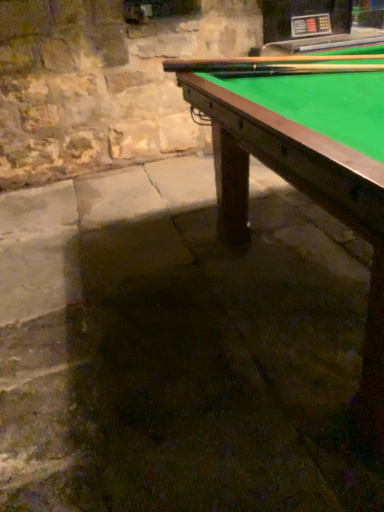
Describe the element at coordinates (306, 195) in the screenshot. I see `green felt billiard table at upper right` at that location.

Image resolution: width=384 pixels, height=512 pixels. In order to click on green felt billiard table at upper right in this screenshot , I will do `click(306, 195)`.

Considering the positions of objects green felt billiard table at upper right and smooth wood cue at upper right, the 2th cue in the top-to-bottom sequence, in the image provided, who is in front, green felt billiard table at upper right or smooth wood cue at upper right, the 2th cue in the top-to-bottom sequence,?

green felt billiard table at upper right is in front.

From the image's perspective, between green felt billiard table at upper right and smooth wood cue at upper right, which is the first cue from bottom to top, who is located below?

From the image's view, green felt billiard table at upper right is below.

Is green felt billiard table at upper right inside or outside of smooth wood cue at upper right, the 2th cue in the top-to-bottom sequence?

green felt billiard table at upper right is located beyond the bounds of smooth wood cue at upper right, the 2th cue in the top-to-bottom sequence.

Is green felt billiard table at upper right positioned far away from smooth wood cue at upper right, the 2th cue in the top-to-bottom sequence?

That's not correct — green felt billiard table at upper right is a little close to smooth wood cue at upper right, the 2th cue in the top-to-bottom sequence.

Can wooden cue at upper right, positioned as the second cue in bottom-to-top order, be found inside smooth wood cue at upper right, which is the first cue from bottom to top?

No, wooden cue at upper right, positioned as the second cue in bottom-to-top order, is not inside smooth wood cue at upper right, which is the first cue from bottom to top.

Is smooth wood cue at upper right, the 2th cue in the top-to-bottom sequence, at the right side of wooden cue at upper right, marked as the 1th cue in a top-to-bottom arrangement?

Indeed, smooth wood cue at upper right, the 2th cue in the top-to-bottom sequence, is positioned on the right side of wooden cue at upper right, marked as the 1th cue in a top-to-bottom arrangement.

Looking at this image, considering the sizes of green felt billiard table at upper right and wooden cue at upper right, positioned as the second cue in bottom-to-top order, in the image, is green felt billiard table at upper right taller or shorter than wooden cue at upper right, positioned as the second cue in bottom-to-top order,?

green felt billiard table at upper right is taller than wooden cue at upper right, positioned as the second cue in bottom-to-top order.

Is green felt billiard table at upper right situated inside wooden cue at upper right, positioned as the second cue in bottom-to-top order, or outside?

green felt billiard table at upper right is not enclosed by wooden cue at upper right, positioned as the second cue in bottom-to-top order.

Is green felt billiard table at upper right placed right next to wooden cue at upper right, marked as the 1th cue in a top-to-bottom arrangement?

They are not placed beside each other.

How different are the orientations of green felt billiard table at upper right and wooden cue at upper right, positioned as the second cue in bottom-to-top order, in degrees?

The angle between the facing direction of green felt billiard table at upper right and the facing direction of wooden cue at upper right, positioned as the second cue in bottom-to-top order, is 60.3 degrees.

Based on the photo, does wooden cue at upper right, positioned as the second cue in bottom-to-top order, have a greater height compared to green felt billiard table at upper right?

Incorrect, the height of wooden cue at upper right, positioned as the second cue in bottom-to-top order, is not larger of that of green felt billiard table at upper right.

Based on their sizes in the image, would you say wooden cue at upper right, marked as the 1th cue in a top-to-bottom arrangement, is bigger or smaller than green felt billiard table at upper right?

Considering their sizes, wooden cue at upper right, marked as the 1th cue in a top-to-bottom arrangement, takes up less space than green felt billiard table at upper right.

Which is behind, wooden cue at upper right, marked as the 1th cue in a top-to-bottom arrangement, or green felt billiard table at upper right?

wooden cue at upper right, marked as the 1th cue in a top-to-bottom arrangement, is further from the camera.

From the image's perspective, would you say wooden cue at upper right, positioned as the second cue in bottom-to-top order, is positioned over green felt billiard table at upper right?

Yes.

Is smooth wood cue at upper right, the 2th cue in the top-to-bottom sequence, to the right of green felt billiard table at upper right from the viewer's perspective?

No.

Consider the image. How many degrees apart are the facing directions of smooth wood cue at upper right, which is the first cue from bottom to top, and green felt billiard table at upper right?

There is a 60.3-degree angle between the facing directions of smooth wood cue at upper right, which is the first cue from bottom to top, and green felt billiard table at upper right.

Is smooth wood cue at upper right, which is the first cue from bottom to top, facing towards green felt billiard table at upper right?

Yes, smooth wood cue at upper right, which is the first cue from bottom to top, is facing green felt billiard table at upper right.

Between wooden cue at upper right, positioned as the second cue in bottom-to-top order, and smooth wood cue at upper right, the 2th cue in the top-to-bottom sequence, which one has larger width?

With larger width is wooden cue at upper right, positioned as the second cue in bottom-to-top order.

Are wooden cue at upper right, marked as the 1th cue in a top-to-bottom arrangement, and smooth wood cue at upper right, which is the first cue from bottom to top, beside each other?

Indeed, wooden cue at upper right, marked as the 1th cue in a top-to-bottom arrangement, and smooth wood cue at upper right, which is the first cue from bottom to top, are beside each other and touching.

Is wooden cue at upper right, marked as the 1th cue in a top-to-bottom arrangement, spatially inside smooth wood cue at upper right, the 2th cue in the top-to-bottom sequence, or outside of it?

The correct answer is: outside.

From a real-world perspective, is wooden cue at upper right, marked as the 1th cue in a top-to-bottom arrangement, positioned above or below smooth wood cue at upper right, which is the first cue from bottom to top?

wooden cue at upper right, marked as the 1th cue in a top-to-bottom arrangement, is situated higher than smooth wood cue at upper right, which is the first cue from bottom to top, in the real world.

At what (x,y) coordinates should I click in order to perform the action: click on billiard table located on the right of smooth wood cue at upper right, which is the first cue from bottom to top. Please return your answer as a coordinate pair (x, y). Looking at the image, I should click on (306, 195).

At what (x,y) coordinates should I click in order to perform the action: click on cue above the smooth wood cue at upper right, the 2th cue in the top-to-bottom sequence (from the image's perspective). Please return your answer as a coordinate pair (x, y). The height and width of the screenshot is (512, 384). Looking at the image, I should click on (280, 63).

Estimate the real-world distances between objects in this image. Which object is closer to smooth wood cue at upper right, the 2th cue in the top-to-bottom sequence, wooden cue at upper right, positioned as the second cue in bottom-to-top order, or green felt billiard table at upper right?

wooden cue at upper right, positioned as the second cue in bottom-to-top order.

When comparing their distances from green felt billiard table at upper right, does wooden cue at upper right, positioned as the second cue in bottom-to-top order, or smooth wood cue at upper right, which is the first cue from bottom to top, seem closer?

Among the two, smooth wood cue at upper right, which is the first cue from bottom to top, is located nearer to green felt billiard table at upper right.

Based on their spatial positions, is smooth wood cue at upper right, the 2th cue in the top-to-bottom sequence, or wooden cue at upper right, marked as the 1th cue in a top-to-bottom arrangement, closer to green felt billiard table at upper right?

The object closer to green felt billiard table at upper right is smooth wood cue at upper right, the 2th cue in the top-to-bottom sequence.

Consider the image. Looking at the image, which one is located closer to wooden cue at upper right, positioned as the second cue in bottom-to-top order, smooth wood cue at upper right, the 2th cue in the top-to-bottom sequence, or green felt billiard table at upper right?

smooth wood cue at upper right, the 2th cue in the top-to-bottom sequence.

Based on their spatial positions, is green felt billiard table at upper right or wooden cue at upper right, positioned as the second cue in bottom-to-top order, closer to smooth wood cue at upper right, the 2th cue in the top-to-bottom sequence?

wooden cue at upper right, positioned as the second cue in bottom-to-top order, is positioned closer to the anchor smooth wood cue at upper right, the 2th cue in the top-to-bottom sequence.

Looking at the image, which one is located closer to wooden cue at upper right, marked as the 1th cue in a top-to-bottom arrangement, green felt billiard table at upper right or smooth wood cue at upper right, which is the first cue from bottom to top?

Based on the image, smooth wood cue at upper right, which is the first cue from bottom to top, appears to be nearer to wooden cue at upper right, marked as the 1th cue in a top-to-bottom arrangement.

The image size is (384, 512). In order to click on cue positioned between green felt billiard table at upper right and smooth wood cue at upper right, the 2th cue in the top-to-bottom sequence, from near to far in this screenshot , I will do `click(280, 63)`.